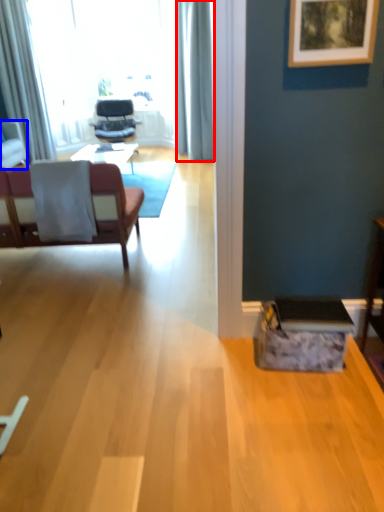
Question: Which point is further to the camera, curtain (highlighted by a red box) or chair (highlighted by a blue box)?

Choices:
 (A) curtain
 (B) chair

Answer: (A)